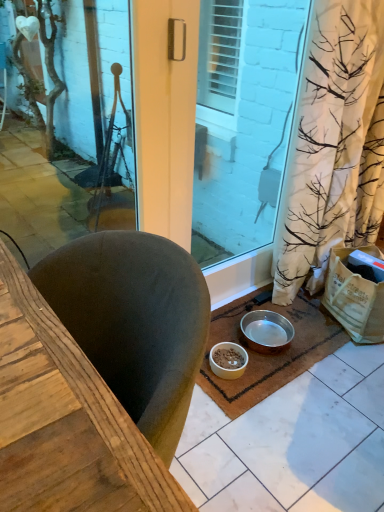
Where is `free spot in front of white matte bowl at lower center, arranged as the 2th bowl when viewed from the right`? The image size is (384, 512). free spot in front of white matte bowl at lower center, arranged as the 2th bowl when viewed from the right is located at coordinates (231, 396).